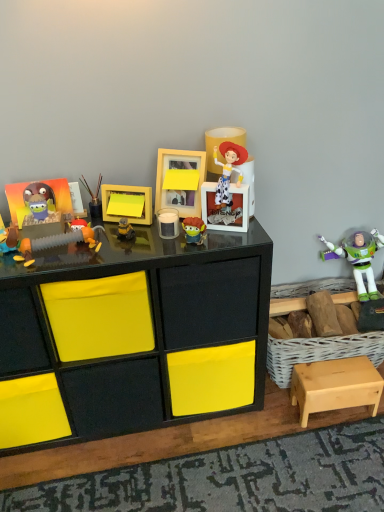
Find the location of `vacant space to the right of matte plastic toy at left, which is the first toy from left to right`. vacant space to the right of matte plastic toy at left, which is the first toy from left to right is located at coordinates (55, 256).